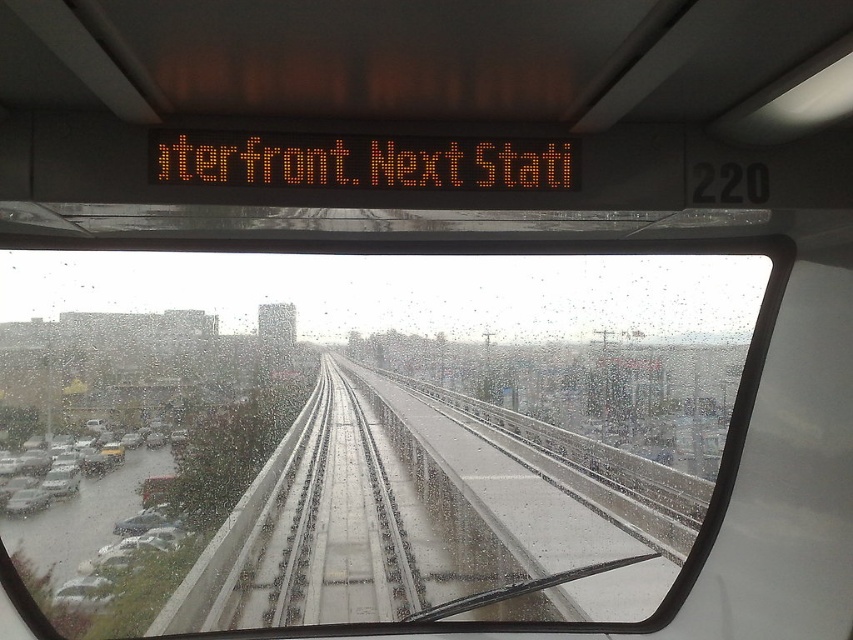
Which is above, transparent glass windshield at center or matte silver car at lower left?

transparent glass windshield at center is above.

Does transparent glass windshield at center have a larger size compared to matte silver car at lower left?

Correct, transparent glass windshield at center is larger in size than matte silver car at lower left.

Between point (645, 467) and point (73, 497), which one is positioned in front?

Point (73, 497)

Image resolution: width=853 pixels, height=640 pixels. Identify the location of transparent glass windshield at center. (363, 433).